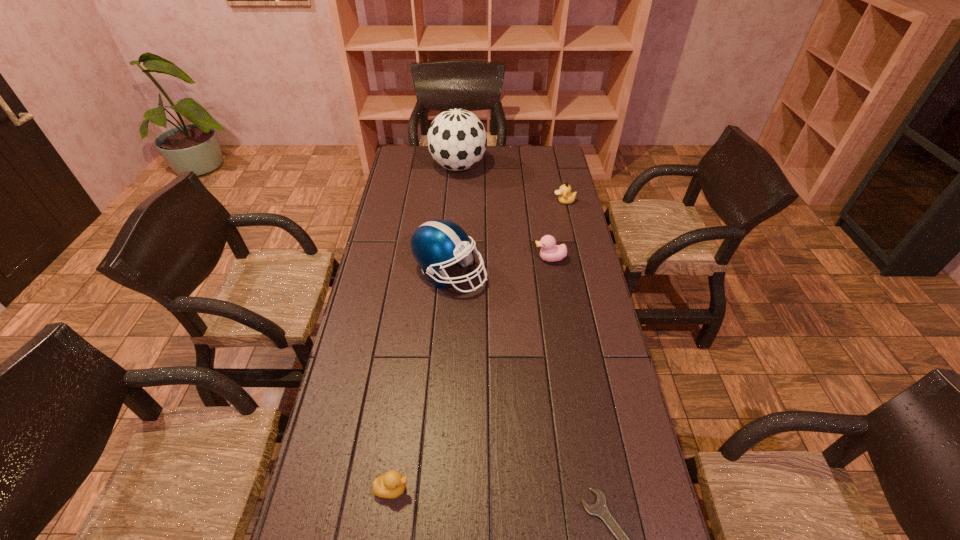
Locate an element on the screen. The height and width of the screenshot is (540, 960). free space at the right edge is located at coordinates (594, 427).

In the image, there is a desktop. Find the location of `vacant space at the far left corner`. vacant space at the far left corner is located at coordinates (412, 160).

Identify the location of empty space between the nearest duckling and the farthest duckling. (478, 345).

What are the coordinates of `vacant point located between the leftmost duckling and the second farthest object` in the screenshot? It's located at (478, 345).

Identify the location of free space that is in between the farthest object and the second shortest object. This screenshot has width=960, height=540. pyautogui.click(x=425, y=328).

This screenshot has height=540, width=960. What are the coordinates of `empty space that is in between the nearest duckling and the second nearest duckling` in the screenshot? It's located at (471, 374).

I want to click on free space between the farthest duckling and the second nearest duckling, so click(x=557, y=230).

The width and height of the screenshot is (960, 540). I want to click on vacant space that is in between the second nearest duckling and the fifth shortest object, so click(500, 266).

I want to click on object that is the third nearest to the second nearest duckling, so click(457, 140).

Locate an element on the screen. object that is the third closest to the fifth shortest object is located at coordinates (457, 140).